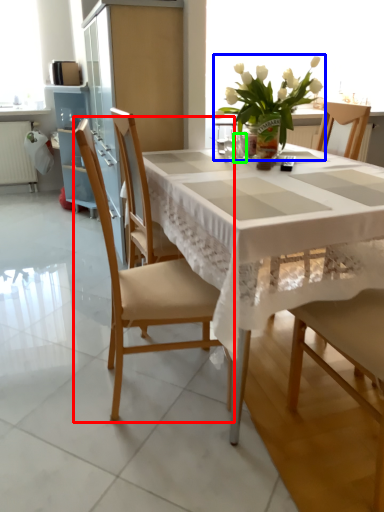
Question: Which is farther away from chair (highlighted by a red box)? houseplant (highlighted by a blue box) or tableware (highlighted by a green box)?

Choices:
 (A) houseplant
 (B) tableware

Answer: (A)